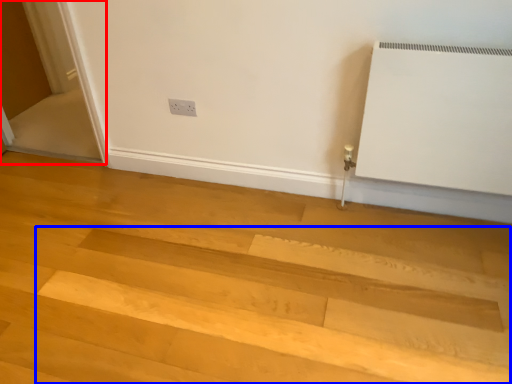
Question: Among these objects, which one is farthest to the camera, screen door (highlighted by a red box) or stairwell (highlighted by a blue box)?

Choices:
 (A) screen door
 (B) stairwell

Answer: (A)